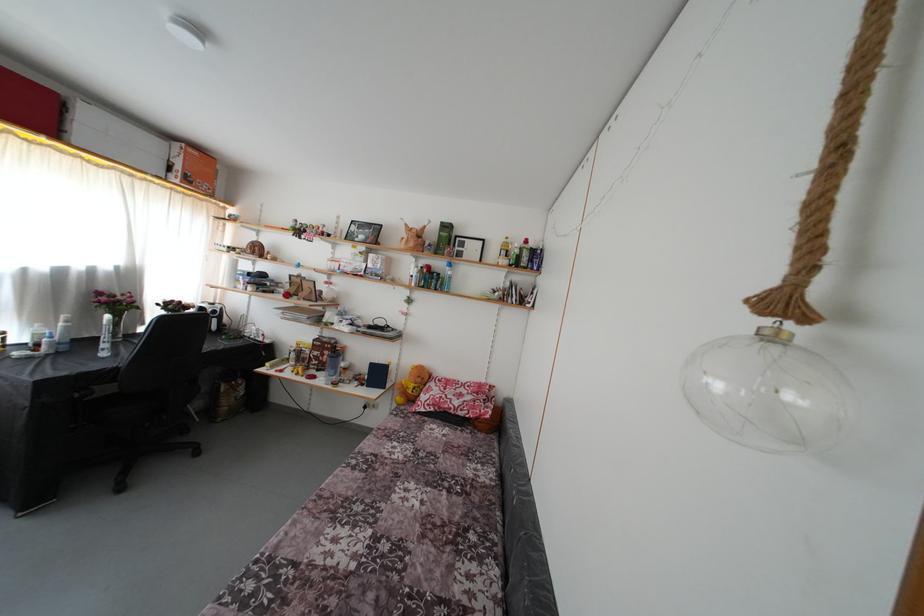
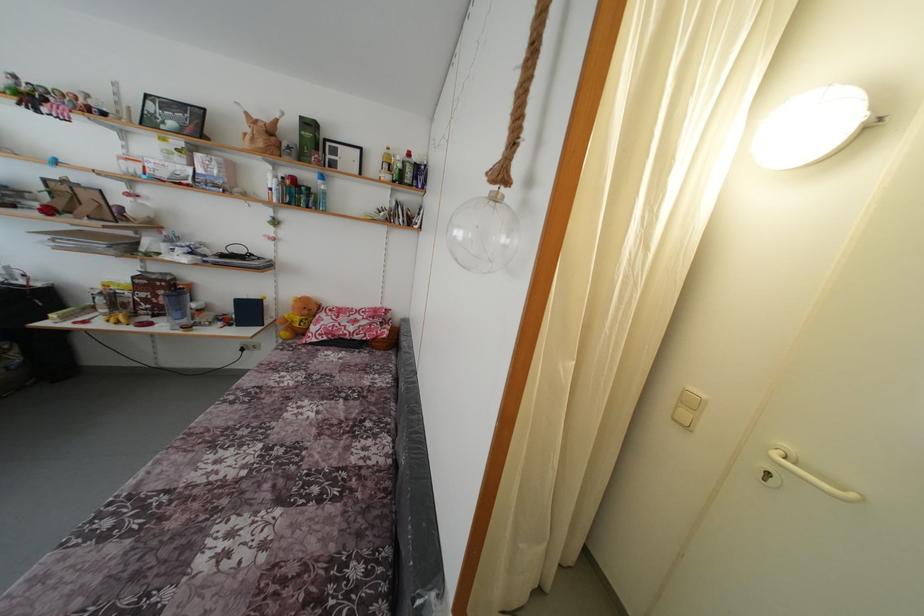
Find the pixel in the second image that matches (x=453, y=274) in the first image.

(324, 188)